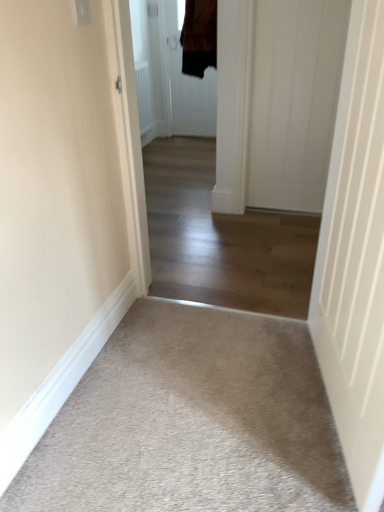
Question: Can you confirm if beige carpet at lower left is taller than brown fabric door at center, which ranks as the third door in front-to-back order?

Choices:
 (A) yes
 (B) no

Answer: (B)

Question: Is beige carpet at lower left far away from brown fabric door at center, the first door positioned from the back?

Choices:
 (A) no
 (B) yes

Answer: (B)

Question: From a real-world perspective, is beige carpet at lower left under brown fabric door at center, the 1th door positioned from the left?

Choices:
 (A) yes
 (B) no

Answer: (A)

Question: Is the surface of beige carpet at lower left in direct contact with brown fabric door at center, which ranks as the third door in front-to-back order?

Choices:
 (A) no
 (B) yes

Answer: (A)

Question: Can you confirm if beige carpet at lower left is positioned to the right of brown fabric door at center, the 1th door positioned from the left?

Choices:
 (A) yes
 (B) no

Answer: (A)

Question: Considering the positions of white smooth door at right, marked as the second door in a back-to-front arrangement, and beige carpet at lower left in the image, is white smooth door at right, marked as the second door in a back-to-front arrangement, wider or thinner than beige carpet at lower left?

Choices:
 (A) thin
 (B) wide

Answer: (A)

Question: From their relative heights in the image, would you say white smooth door at right, marked as the second door in a back-to-front arrangement, is taller or shorter than beige carpet at lower left?

Choices:
 (A) tall
 (B) short

Answer: (A)

Question: Is white smooth door at right, arranged as the 2th door when viewed from the top, to the left or to the right of beige carpet at lower left in the image?

Choices:
 (A) right
 (B) left

Answer: (A)

Question: Does point (306, 138) appear closer or farther from the camera than point (337, 482)?

Choices:
 (A) closer
 (B) farther

Answer: (B)

Question: From the image's perspective, is beige carpet at lower left positioned above or below brown fabric door at center, which appears as the 3th door when viewed from the right?

Choices:
 (A) above
 (B) below

Answer: (B)

Question: From a real-world perspective, is beige carpet at lower left above or below brown fabric door at center, the 1th door when ordered from top to bottom?

Choices:
 (A) below
 (B) above

Answer: (A)

Question: Would you say beige carpet at lower left is inside or outside brown fabric door at center, the 1th door when ordered from top to bottom?

Choices:
 (A) inside
 (B) outside

Answer: (B)

Question: Considering their positions, is beige carpet at lower left located in front of or behind brown fabric door at center, the 1th door positioned from the left?

Choices:
 (A) behind
 (B) front

Answer: (B)

Question: Does point (379, 190) appear closer or farther from the camera than point (192, 262)?

Choices:
 (A) closer
 (B) farther

Answer: (A)

Question: Is white smooth door at right, the second door when ordered from left to right, inside the boundaries of light beige carpet at center, or outside?

Choices:
 (A) outside
 (B) inside

Answer: (A)